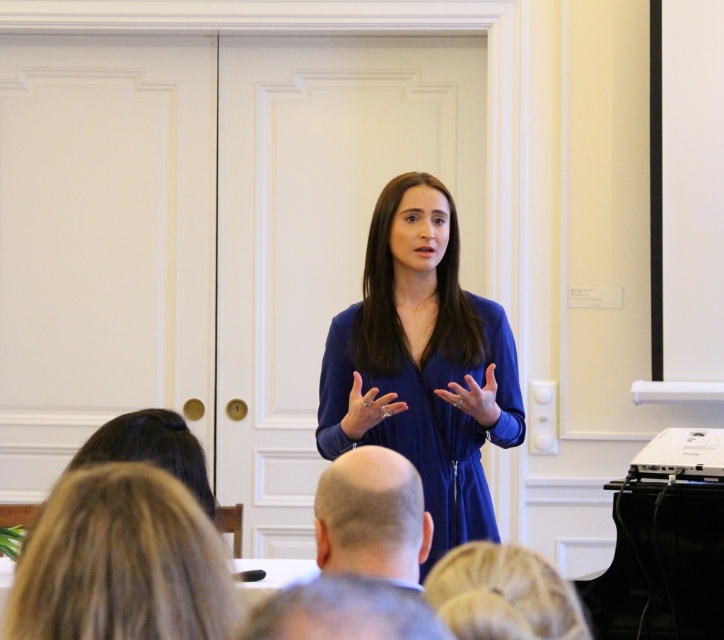
Looking at this image, you are a photographer standing in the conference room. You want to take a photo of the woman in the blue zip up dress and the gray hair at lower center. The minimum distance between the two subjects for the camera to focus properly is 36 inches. Can you take the photo with both subjects in focus?

The gray hair at lower center and the woman in the blue zip up dress are 37.41 inches apart, which exceeds the minimum required distance of 36 inches. Therefore, the camera can focus on both subjects.

You are an attendee at the conference and you want to take a photo of the speaker. The gray hair at lower center and matte blue dress at center are both in your camera frame. Which object should you focus on first if you want to capture both clearly?

The gray hair at lower center is shorter than matte blue dress at center, so you should focus on the matte blue dress at center first since it is taller and more prominent in the frame.

In the scene shown: You are standing in the conference room and want to take a photo of the speaker. The camera you have is 36 inches away from the point at coordinates point (387, 608). Is the camera close enough to capture the speaker clearly?

The point at coordinates point (387, 608) and the camera are 39.06 inches apart. Since the camera is only 36 inches away, it is closer than the required distance, so yes, the camera is close enough to capture the speaker clearly.